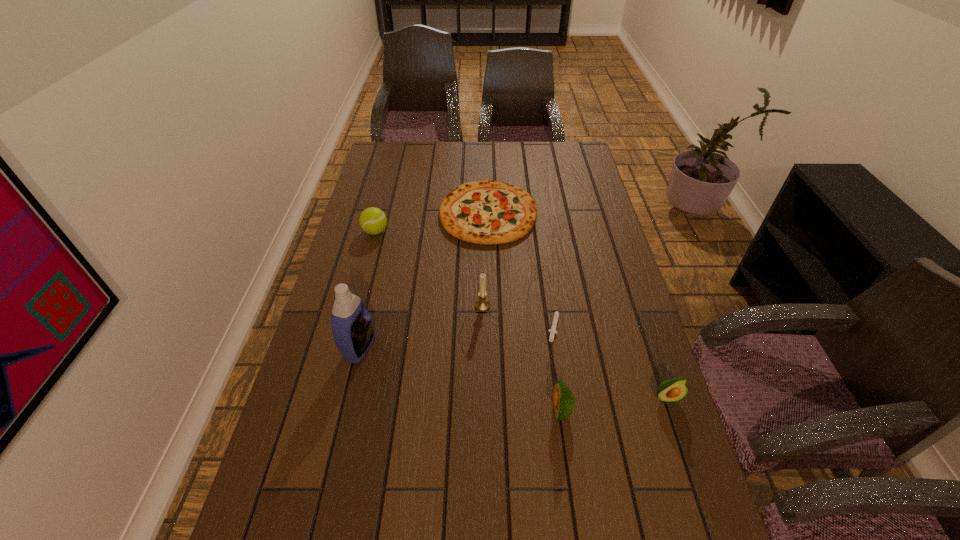
This screenshot has width=960, height=540. In order to click on the taller avocado in this screenshot , I will do `click(563, 399)`.

The width and height of the screenshot is (960, 540). Find the location of `the shorter avocado`. the shorter avocado is located at coordinates (672, 390).

Where is `the right avocado`? The height and width of the screenshot is (540, 960). the right avocado is located at coordinates (672, 390).

I want to click on pizza, so click(x=488, y=212).

In order to click on tennis ball in this screenshot , I will do `click(372, 220)`.

What are the coordinates of `detergent` in the screenshot? It's located at (352, 327).

The image size is (960, 540). In order to click on candle holder in this screenshot , I will do `click(482, 304)`.

This screenshot has height=540, width=960. I want to click on syringe, so click(553, 331).

At what (x,y) coordinates should I click in order to perform the action: click on blank space located 0.110m on the cut side of the left avocado. Please return your answer as a coordinate pair (x, y). The image size is (960, 540). Looking at the image, I should click on (503, 410).

Where is `vacant region located on the cut side of the left avocado`? Image resolution: width=960 pixels, height=540 pixels. vacant region located on the cut side of the left avocado is located at coordinates (520, 410).